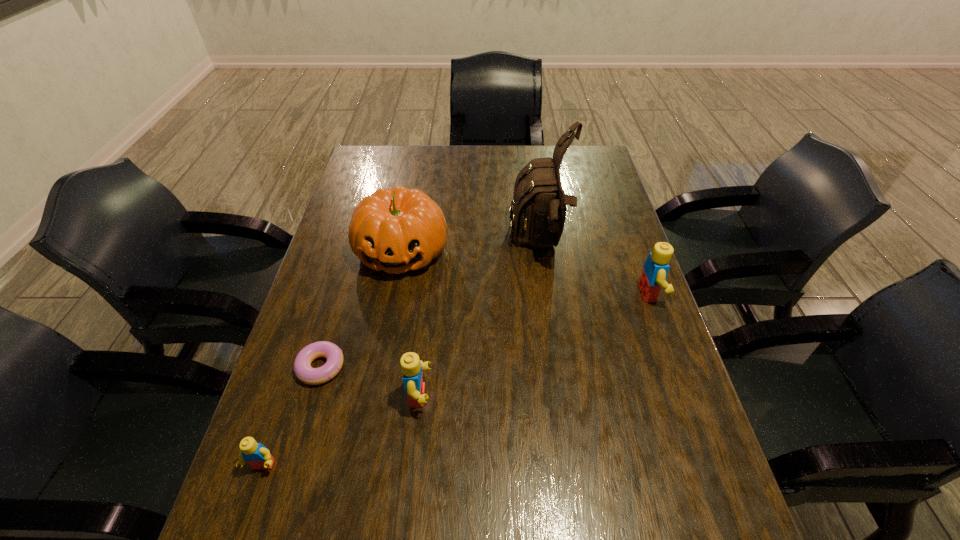
What are the coordinates of `free location that satisfies the following two spatial constraints: 1. on the front-facing side of the farthest Lego; 2. on the front-facing side of the second shortest object` in the screenshot? It's located at (711, 466).

Locate an element on the screen. Image resolution: width=960 pixels, height=540 pixels. vacant area in the image that satisfies the following two spatial constraints: 1. on the front-facing side of the shoulder bag; 2. on the carved face of the pumpkin is located at coordinates (540, 250).